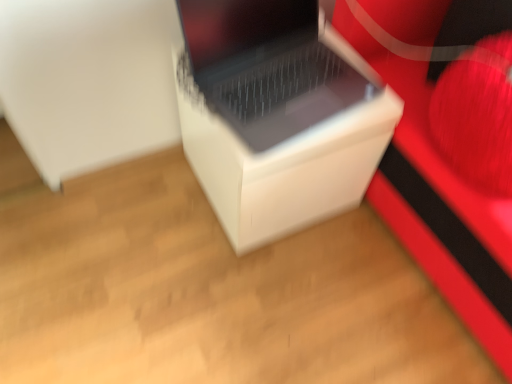
Question: Considering the positions of white plastic laptop at center and white matte cardboard box at center in the image, is white plastic laptop at center wider or thinner than white matte cardboard box at center?

Choices:
 (A) thin
 (B) wide

Answer: (A)

Question: Would you say white plastic laptop at center is to the left or to the right of white matte cardboard box at center in the picture?

Choices:
 (A) left
 (B) right

Answer: (B)

Question: Based on their relative distances, which object is farther from the white plastic laptop at center?

Choices:
 (A) white matte cardboard box at center
 (B) matte white speaker at center

Answer: (B)

Question: Based on their relative distances, which object is farther from the white plastic laptop at center?

Choices:
 (A) matte white speaker at center
 (B) white matte cardboard box at center

Answer: (A)